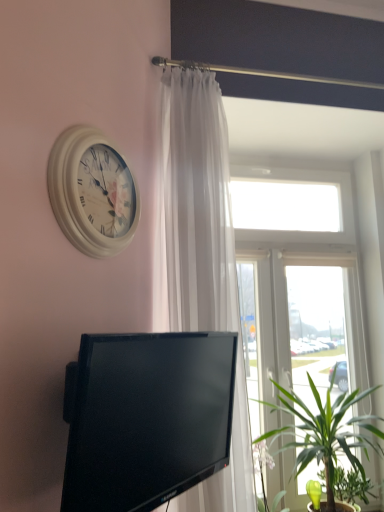
Question: From a real-world perspective, is transparent glass window at upper center beneath green leafy plant at lower right?

Choices:
 (A) no
 (B) yes

Answer: (A)

Question: Does transparent glass window at upper center have a larger size compared to green leafy plant at lower right?

Choices:
 (A) no
 (B) yes

Answer: (B)

Question: Is transparent glass window at upper center turned away from green leafy plant at lower right?

Choices:
 (A) yes
 (B) no

Answer: (A)

Question: Can you confirm if transparent glass window at upper center is shorter than green leafy plant at lower right?

Choices:
 (A) yes
 (B) no

Answer: (B)

Question: Considering the relative sizes of transparent glass window at upper center and green leafy plant at lower right in the image provided, is transparent glass window at upper center taller than green leafy plant at lower right?

Choices:
 (A) yes
 (B) no

Answer: (A)

Question: Is white wooden clock at upper left inside the boundaries of black glossy tv at lower center, or outside?

Choices:
 (A) inside
 (B) outside

Answer: (B)

Question: Visually, is white wooden clock at upper left positioned to the left or to the right of black glossy tv at lower center?

Choices:
 (A) right
 (B) left

Answer: (B)

Question: Considering the positions of white wooden clock at upper left and black glossy tv at lower center in the image, is white wooden clock at upper left taller or shorter than black glossy tv at lower center?

Choices:
 (A) tall
 (B) short

Answer: (B)

Question: From the image's perspective, is white wooden clock at upper left positioned above or below black glossy tv at lower center?

Choices:
 (A) above
 (B) below

Answer: (A)

Question: Is green leafy plant at lower right in front of or behind transparent glass window at upper center in the image?

Choices:
 (A) behind
 (B) front

Answer: (B)

Question: In terms of height, does green leafy plant at lower right look taller or shorter compared to transparent glass window at upper center?

Choices:
 (A) short
 (B) tall

Answer: (A)

Question: Based on their sizes in the image, would you say green leafy plant at lower right is bigger or smaller than transparent glass window at upper center?

Choices:
 (A) small
 (B) big

Answer: (A)

Question: From the image's perspective, is green leafy plant at lower right above or below transparent glass window at upper center?

Choices:
 (A) above
 (B) below

Answer: (B)

Question: From a real-world perspective, relative to green leafy plant at lower right, is transparent glass window at upper center vertically above or below?

Choices:
 (A) below
 (B) above

Answer: (B)

Question: Looking at the image, does transparent glass window at upper center seem bigger or smaller compared to green leafy plant at lower right?

Choices:
 (A) small
 (B) big

Answer: (B)